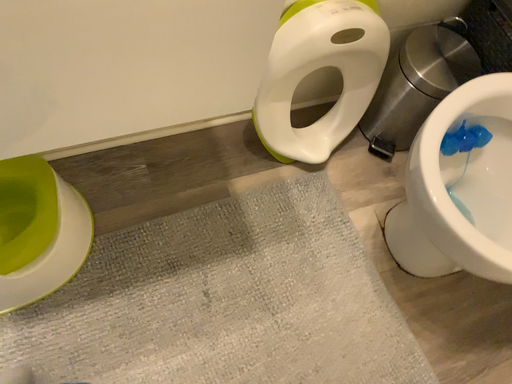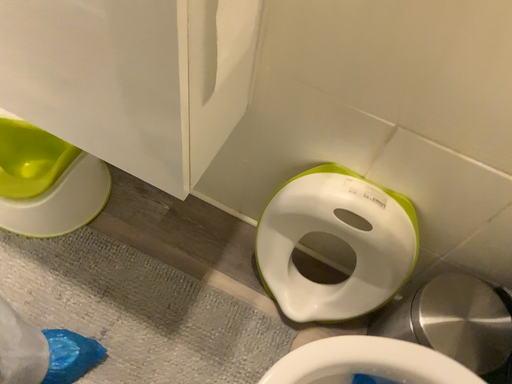
Question: How did the camera likely rotate when shooting the video?

Choices:
 (A) rotated left
 (B) rotated right

Answer: (A)